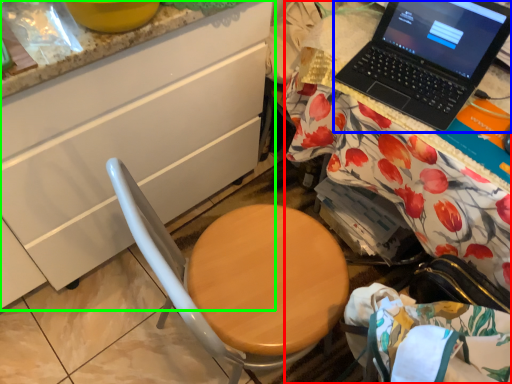
Question: Considering the real-world distances, which object is farthest from desk (highlighted by a red box)? laptop (highlighted by a blue box) or cabinetry (highlighted by a green box)?

Choices:
 (A) laptop
 (B) cabinetry

Answer: (B)